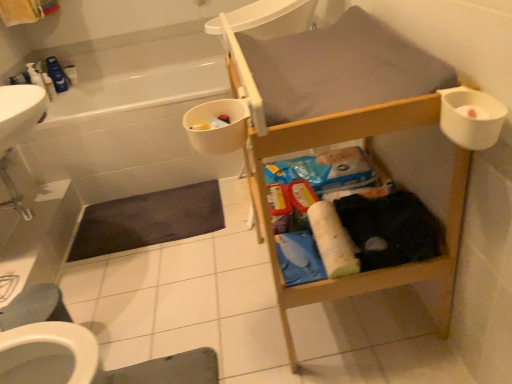
Locate an element on the screen. This screenshot has height=384, width=512. free area in between gray fabric bath mat at lower center, which is the first bath mat in front-to-back order, and dark matte bath mat at lower left, the first bath mat when ordered from top to bottom is located at coordinates (156, 287).